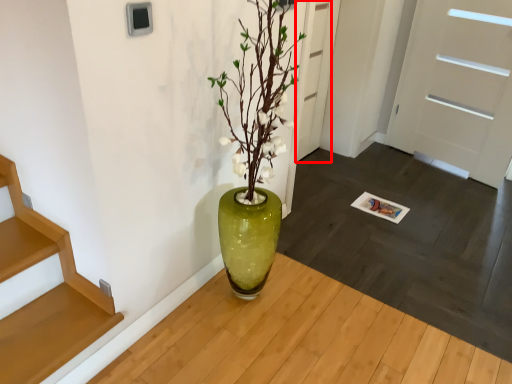
Question: From the image, what is the correct spatial relationship of door (annotated by the red box) in relation to door?

Choices:
 (A) left
 (B) right

Answer: (A)